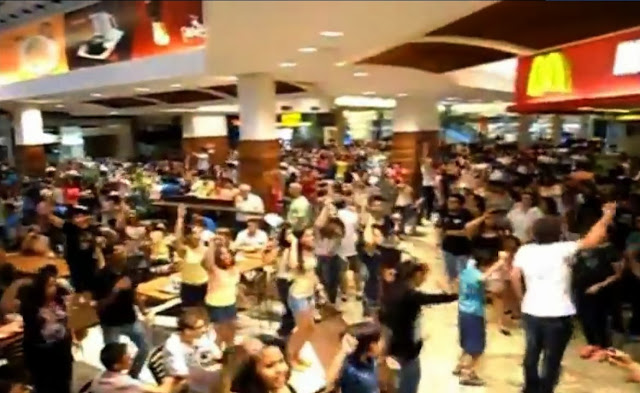
Find the location of a particular element. The height and width of the screenshot is (393, 640). structural pillar is located at coordinates (418, 140).